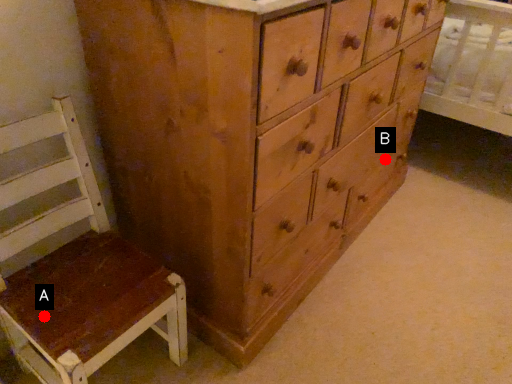
Question: Two points are circled on the image, labeled by A and B beside each circle. Which point appears farthest from the camera in this image?

Choices:
 (A) A is further
 (B) B is further

Answer: (B)